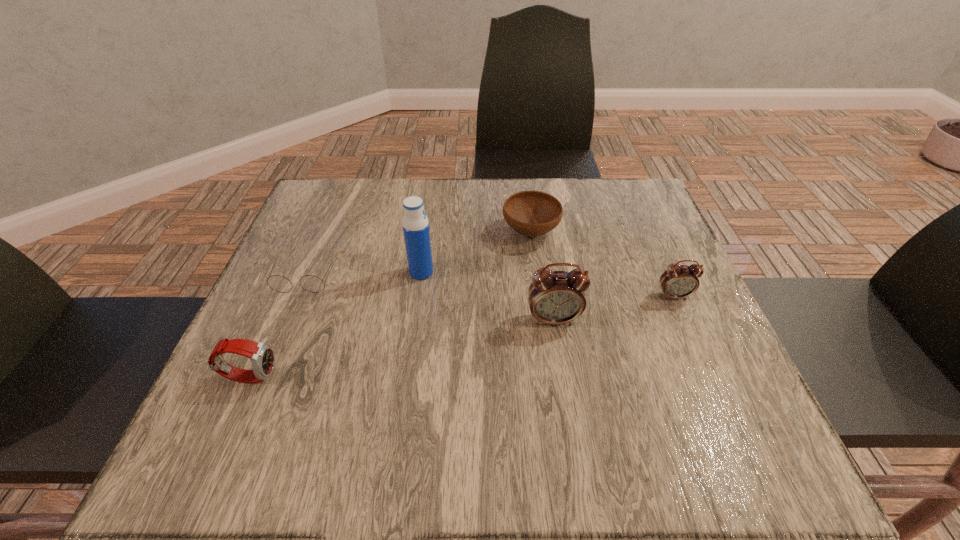
I want to click on the fifth shortest object, so click(555, 297).

Locate an element on the screen. the left alarm clock is located at coordinates (555, 297).

Where is `the right alarm clock`? Image resolution: width=960 pixels, height=540 pixels. the right alarm clock is located at coordinates (679, 281).

This screenshot has height=540, width=960. I want to click on the shorter alarm clock, so click(679, 281).

You are a GUI agent. You are given a task and a screenshot of the screen. Output one action in this format:
    pyautogui.click(x=<x>, y=<y>)
    Task: Click on the shortest object
    This screenshot has width=960, height=540.
    Given the screenshot: What is the action you would take?
    pyautogui.click(x=278, y=283)

At what (x,y) coordinates should I click in order to perform the action: click on the fifth tallest object. Please return your answer as a coordinate pair (x, y). Looking at the image, I should click on (531, 213).

Find the location of a particular element. bowl is located at coordinates (531, 213).

Find the location of a particular element. watch is located at coordinates (262, 357).

Locate an element on the screen. This screenshot has width=960, height=540. water bottle is located at coordinates (415, 224).

Find the location of a particular element. the fourth object from right to left is located at coordinates pos(415,224).